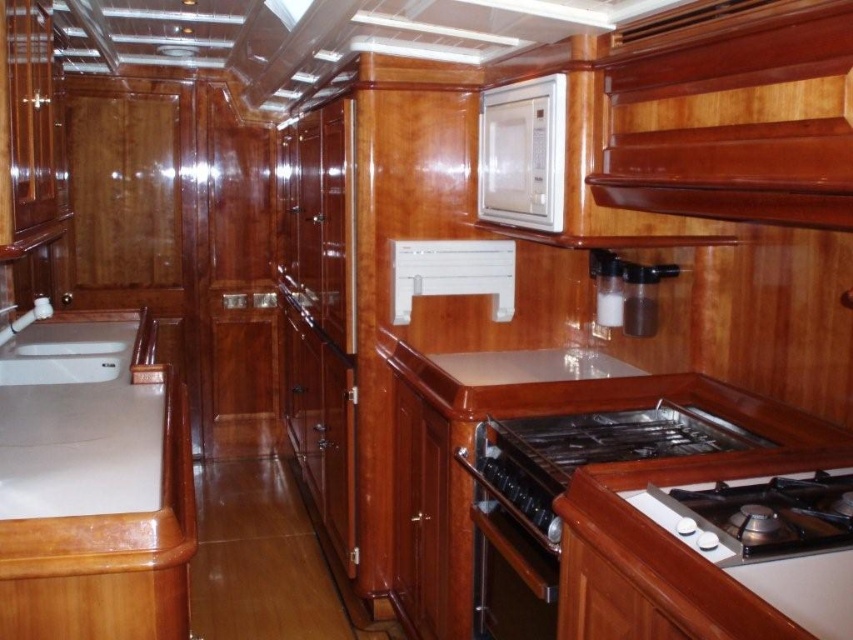
I want to click on black polished metal gas stove at lower right, so click(x=587, y=452).

Does black polished metal gas stove at lower right have a lesser height compared to white glossy gas stove at lower right?

No.

This screenshot has width=853, height=640. I want to click on black polished metal gas stove at lower right, so coord(587,452).

This screenshot has width=853, height=640. Describe the element at coordinates (514, 536) in the screenshot. I see `satin silver oven at center` at that location.

You are a GUI agent. You are given a task and a screenshot of the screen. Output one action in this format:
    pyautogui.click(x=<x>, y=<y>)
    Task: Click on the satin silver oven at center
    
    Given the screenshot: What is the action you would take?
    (x=514, y=536)

Which is above, white glossy microwave at upper center or white glossy sink at lower left?

white glossy microwave at upper center is above.

Can you confirm if white glossy microwave at upper center is wider than white glossy sink at lower left?

No.

Identify the location of white glossy microwave at upper center. Image resolution: width=853 pixels, height=640 pixels. (521, 154).

I want to click on white glossy microwave at upper center, so click(521, 154).